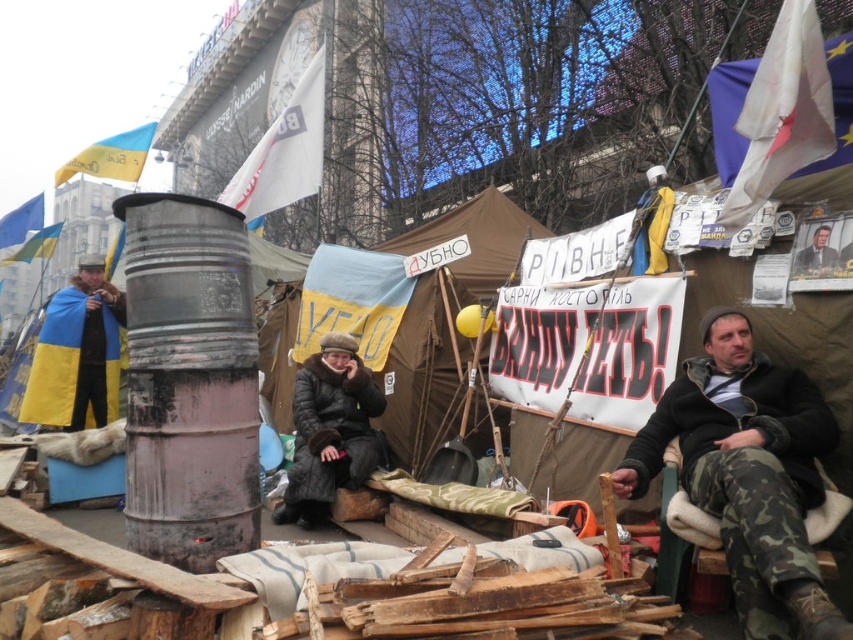
Does yellow-blue fabric draped at left have a greater width compared to smooth gray suit at upper right?

Yes, yellow-blue fabric draped at left is wider than smooth gray suit at upper right.

Between yellow-blue fabric draped at left and smooth gray suit at upper right, which one appears on the left side from the viewer's perspective?

yellow-blue fabric draped at left

You are a GUI agent. You are given a task and a screenshot of the screen. Output one action in this format:
    pyautogui.click(x=<x>, y=<y>)
    Task: Click on the yellow-blue fabric draped at left
    This screenshot has width=853, height=640.
    Given the screenshot: What is the action you would take?
    pyautogui.click(x=77, y=353)

Is point (828, 637) closer to camera compared to point (67, 320)?

That is True.

Which is more to the left, camouflage pants at lower right or yellow-blue fabric draped at left?

Positioned to the left is yellow-blue fabric draped at left.

Between point (689, 412) and point (102, 340), which one is positioned behind?

Point (102, 340)

Image resolution: width=853 pixels, height=640 pixels. Identify the location of camouflage pants at lower right. (747, 474).

Does blue fabric tent at center have a greater width compared to dark brown fur coat at center?

Yes, blue fabric tent at center is wider than dark brown fur coat at center.

Can you confirm if blue fabric tent at center is bigger than dark brown fur coat at center?

Yes.

Between point (474, 429) and point (315, 358), which one is positioned in front?

Point (315, 358) is more forward.

I want to click on blue fabric tent at center, so click(444, 321).